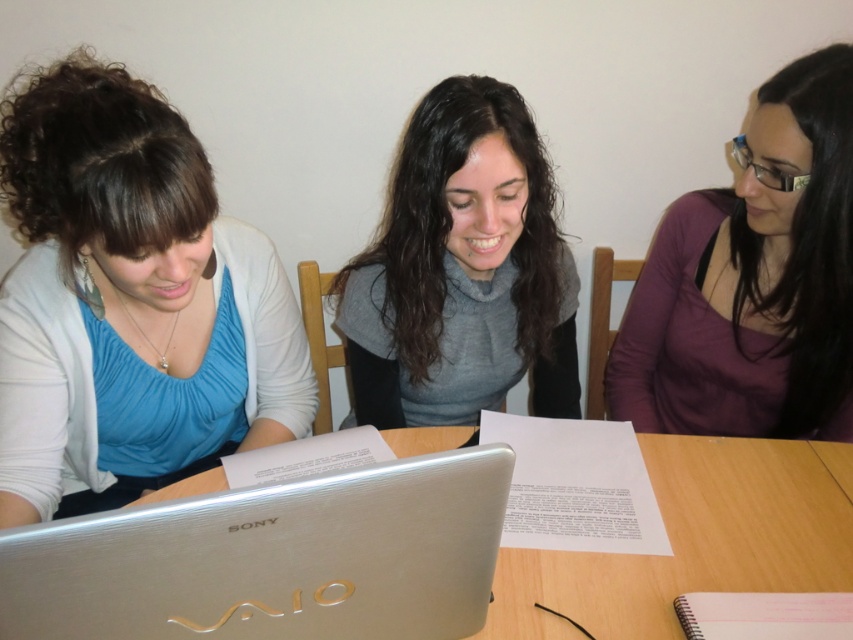
You are a photographer standing at the point with coordinates (129, 301) in the image. Looking around, you see three people at a table. Which person is closest to your current position?

The point at coordinates (129, 301) indicates the matte blue blouse at left, so the person wearing the matte blue blouse at left is closest to your current position.

You are a photographer standing 6 feet away from the table. You want to take a photo of the matte blue blouse at left and the gray soft sweater at center without any obstruction. Can you fit both items in the frame if your camera has a 50mm lens?

The matte blue blouse at left is 12.25 inches away from the gray soft sweater at center. Since the distance between them is less than the camera lens field of view at 50mm, both items can be captured in the frame without obstruction.

You are a fashion designer observing the three people around the table. You need to determine which clothing item, the purple matte shirt at center or the gray soft sweater at center, has a narrower width for a size comparison task. Which one is narrower?

The purple matte shirt at center has a narrower width than the gray soft sweater at center according to the description.